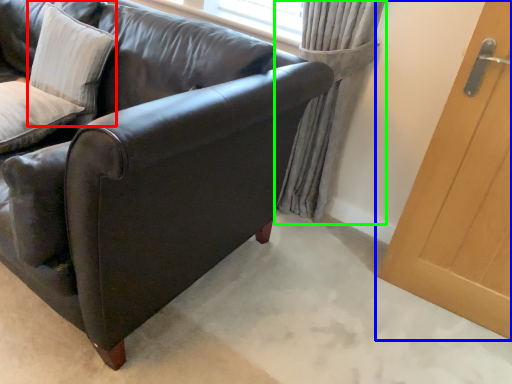
Question: Estimate the real-world distances between objects in this image. Which object is closer to pillow (highlighted by a red box), door (highlighted by a blue box) or curtain (highlighted by a green box)?

Choices:
 (A) door
 (B) curtain

Answer: (B)